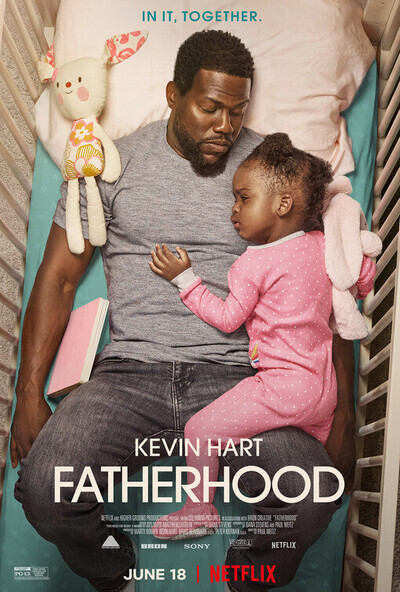
What are the coordinates of `pillow` in the screenshot? It's located at (300, 67).